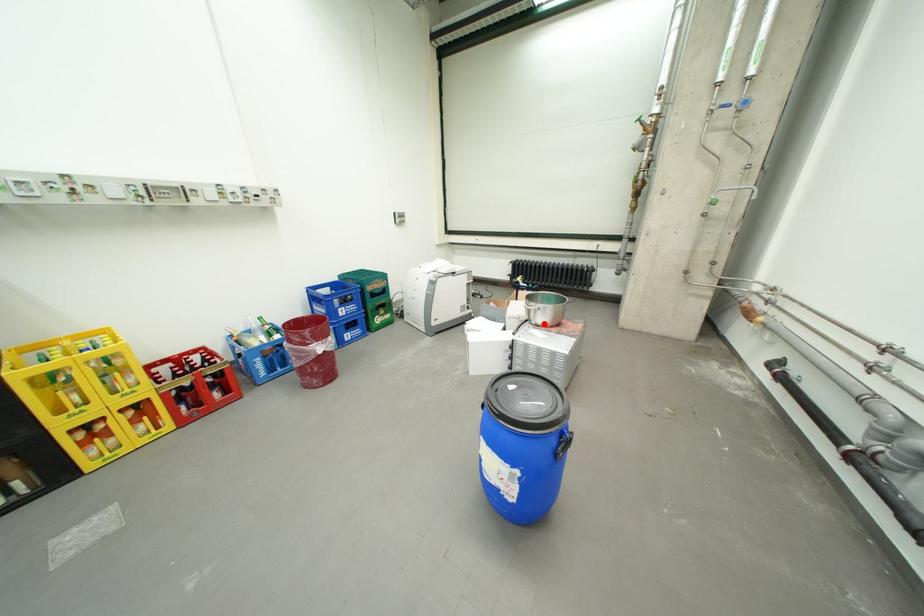
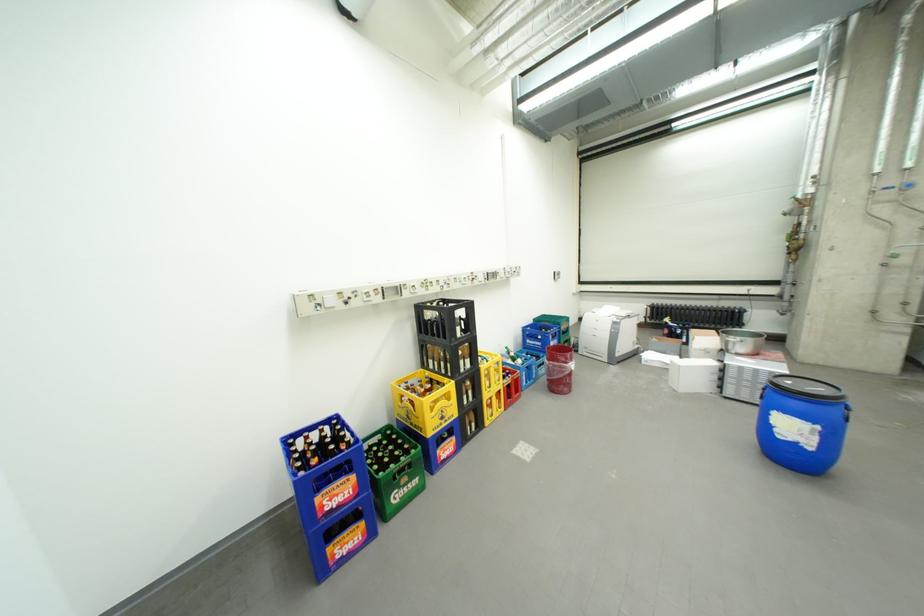
In the second image, find the point that corresponds to the highlighted location in the first image.

(744, 353)